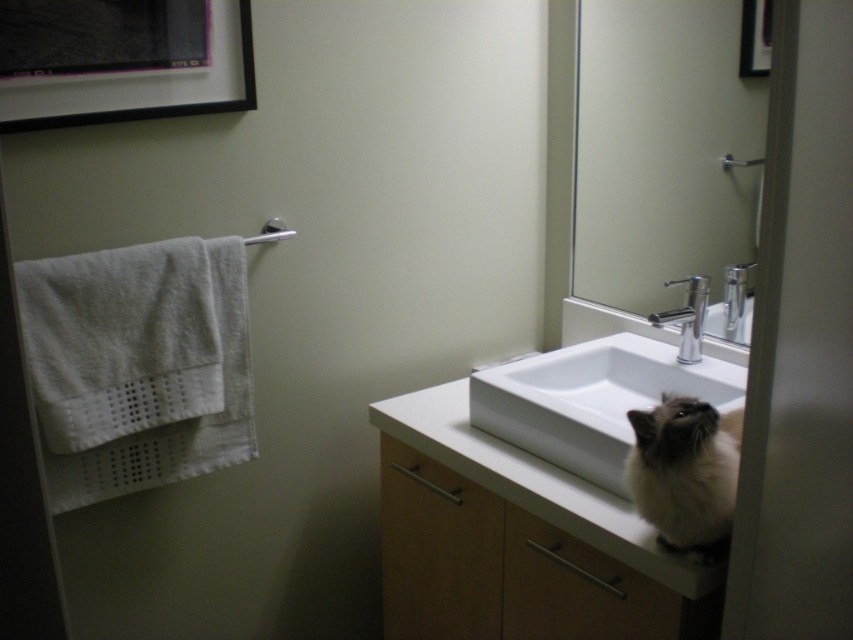
You are a plumber checking the bathroom fixtures. You see the silver metallic faucet at sink right and the silver metallic faucet at upper right. Which one is taller?

The silver metallic faucet at sink right is much taller than the silver metallic faucet at upper right according to the description.

You are standing in the bathroom and want to hang a new picture frame. The current black glossy picture frame at upper right and the silver metallic faucet at upper right are in the way. Which object should you move first to make space?

You should move the black glossy picture frame at upper right first because it is located above the silver metallic faucet at upper right, so moving it would allow access to the area above the faucet.